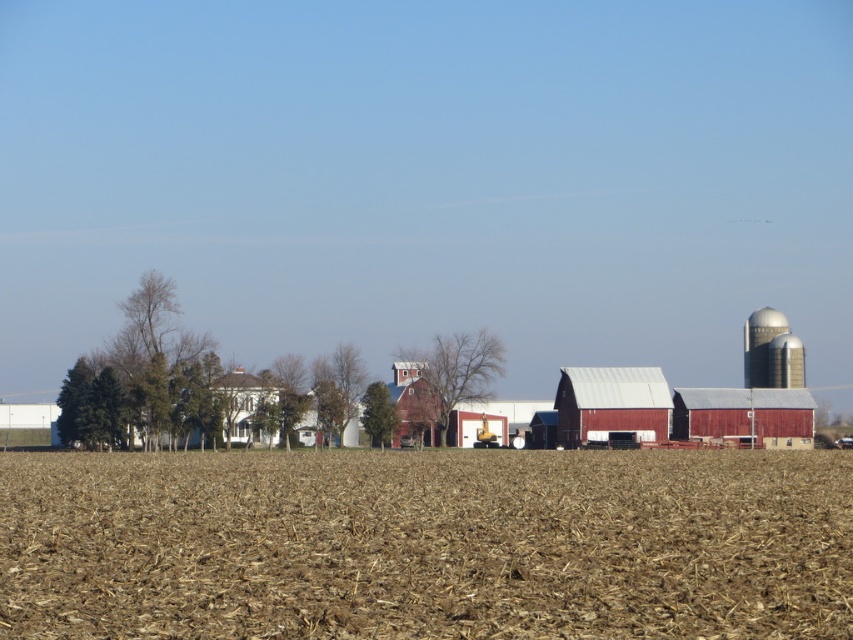
Question: Which point is farther to the camera?

Choices:
 (A) (776, 381)
 (B) (225, 436)
 (C) (753, 412)

Answer: (A)

Question: Can you confirm if brown dirt field at center is bigger than metallic red barn at center?

Choices:
 (A) yes
 (B) no

Answer: (A)

Question: Estimate the real-world distances between objects in this image. Which object is closer to the brown dirt field at center?

Choices:
 (A) metallic red barn at center
 (B) red corrugated metal barn at center
 (C) white painted wood house at left

Answer: (C)

Question: Can you confirm if white painted wood house at left is positioned above metallic silver silo at right?

Choices:
 (A) no
 (B) yes

Answer: (A)

Question: Which of these objects is positioned closest to the metallic red barn at center?

Choices:
 (A) metallic silver silo at right
 (B) white painted wood house at left

Answer: (A)

Question: Is red corrugated metal barn at center above metallic silver silo at right?

Choices:
 (A) no
 (B) yes

Answer: (A)